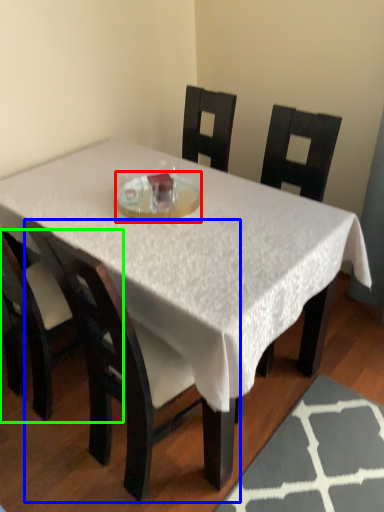
Question: Which object is positioned closest to glass plate (highlighted by a red box)? Select from chair (highlighted by a blue box) and chair (highlighted by a green box).

Choices:
 (A) chair
 (B) chair

Answer: (A)